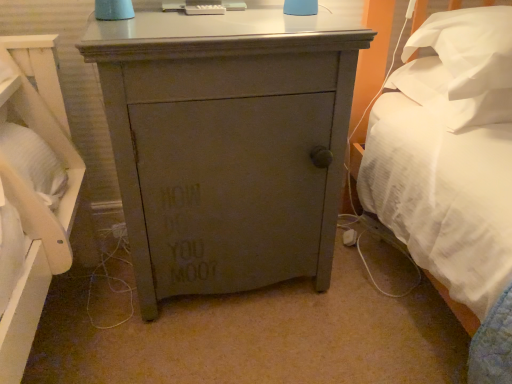
The height and width of the screenshot is (384, 512). What are the coordinates of `free space in front of matte gray cabinet at center` in the screenshot? It's located at (226, 349).